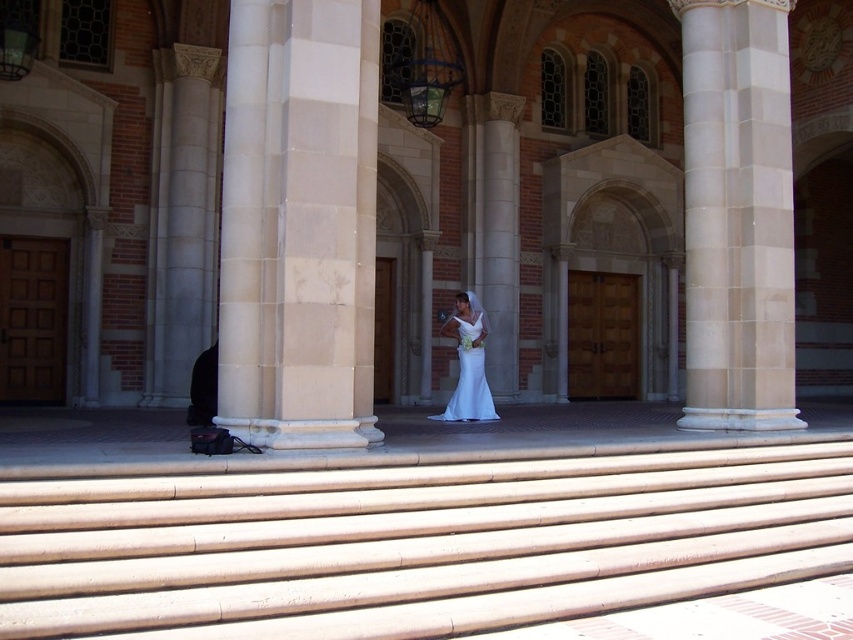
Between point (90, 532) and point (473, 324), which one is positioned behind?

The point (473, 324) is more distant.

In the scene shown: Is smooth concrete stairs at center below white satin dress at center?

Correct, smooth concrete stairs at center is located below white satin dress at center.

Is point (167, 518) behind point (485, 314)?

That is False.

The height and width of the screenshot is (640, 853). I want to click on smooth concrete stairs at center, so click(415, 541).

Which is more to the left, white marble pillar at center or black leather jacket at lower left?

black leather jacket at lower left is more to the left.

Is point (238, 12) positioned before point (200, 420)?

Yes, it is in front of point (200, 420).

Who is more forward, (x=368, y=17) or (x=198, y=400)?

Point (x=368, y=17)

Locate an element on the screen. This screenshot has height=640, width=853. white marble pillar at center is located at coordinates (299, 221).

Is white marble pillar at center below white satin dress at center?

No, white marble pillar at center is not below white satin dress at center.

Consider the image. Which of these two, white marble pillar at center or white satin dress at center, stands taller?

Standing taller between the two is white marble pillar at center.

The width and height of the screenshot is (853, 640). What do you see at coordinates (299, 221) in the screenshot?
I see `white marble pillar at center` at bounding box center [299, 221].

Find the location of a particular element. The image size is (853, 640). white marble pillar at center is located at coordinates (299, 221).